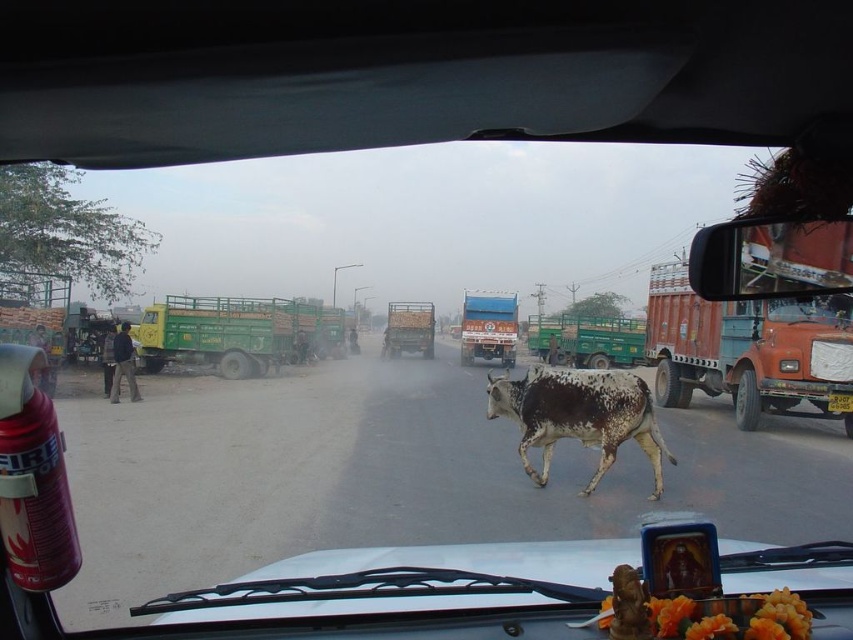
Question: From the image, what is the correct spatial relationship of blue metallic truck at center in relation to green painted truck at center?

Choices:
 (A) right
 (B) left

Answer: (A)

Question: Which point is closer to the camera taking this photo?

Choices:
 (A) (509, 346)
 (B) (393, 324)
 (C) (842, 412)

Answer: (C)

Question: Can you confirm if speckled hide bull at center is positioned below blue metallic truck at center?

Choices:
 (A) no
 (B) yes

Answer: (B)

Question: Which point is closer to the camera taking this photo?

Choices:
 (A) (399, 307)
 (B) (543, 369)
 (C) (474, 323)

Answer: (B)

Question: Which of the following is the closest to the observer?

Choices:
 (A) blue metallic truck at center
 (B) yellow plastic license plate at center
 (C) speckled hide bull at center

Answer: (C)

Question: Observing the image, what is the correct spatial positioning of speckled hide bull at center in reference to blue metallic truck at center?

Choices:
 (A) right
 (B) left

Answer: (B)